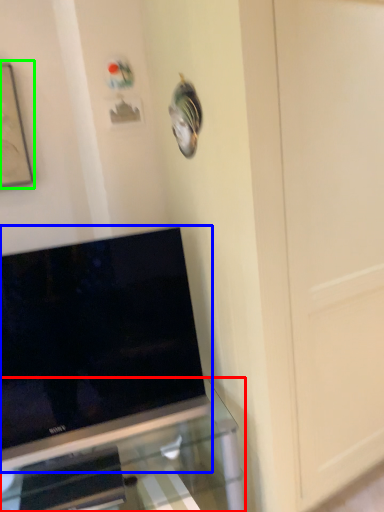
Question: Estimate the real-world distances between objects in this image. Which object is closer to furniture (highlighted by a red box), television (highlighted by a blue box) or picture frame (highlighted by a green box)?

Choices:
 (A) television
 (B) picture frame

Answer: (A)